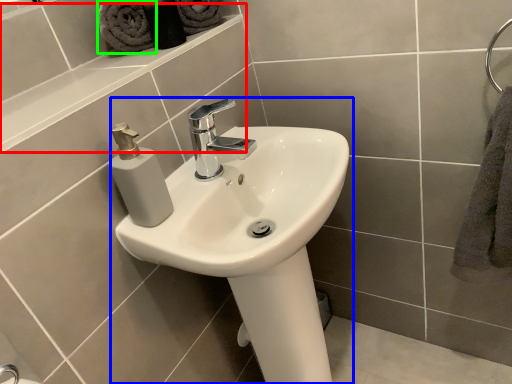
Question: Which object is positioned farthest from ledge (highlighted by a red box)? Select from sink (highlighted by a blue box) and bath towel (highlighted by a green box).

Choices:
 (A) sink
 (B) bath towel

Answer: (A)